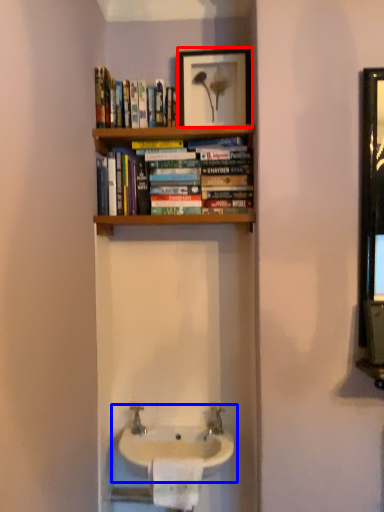
Question: Which object is closer to the camera taking this photo, picture frame (highlighted by a red box) or sink (highlighted by a blue box)?

Choices:
 (A) picture frame
 (B) sink

Answer: (B)